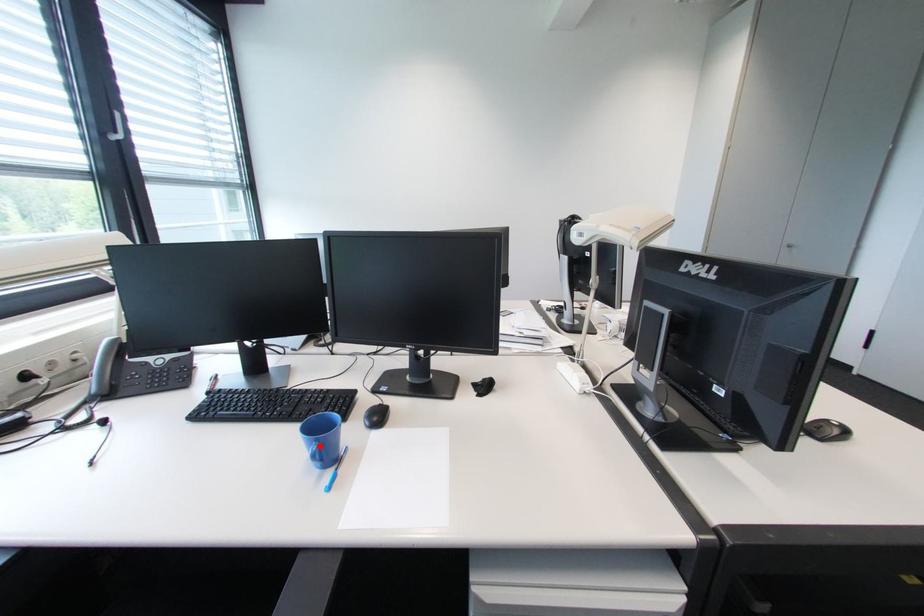
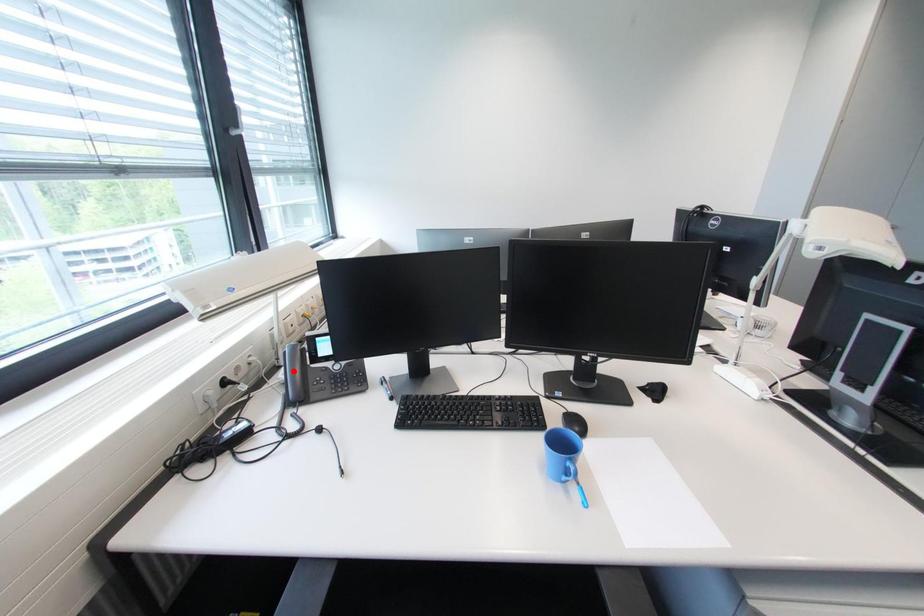
I am providing you with two images of the same scene from different viewpoints. A red point is marked on the first image and another point is marked on the second image. Is the red point in image1 aligned with the point shown in image2?

No